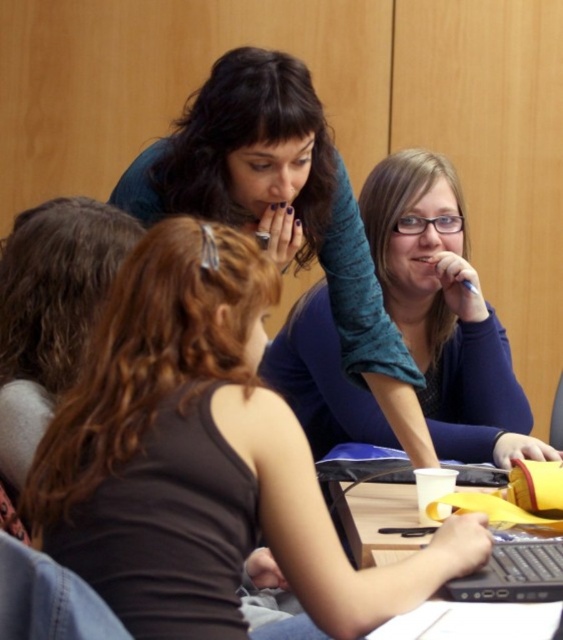
Question: Among these points, which one is nearest to the camera?

Choices:
 (A) (15, 445)
 (B) (122, 573)
 (C) (374, 547)
 (D) (230, 220)

Answer: (B)

Question: Which is nearer to the brown hair at upper left?

Choices:
 (A) wooden table at center
 (B) teal sweater at center
 (C) matte blue shirt at center
 (D) matte blue sweater at center

Answer: (C)

Question: Does teal sweater at center have a larger size compared to matte blue sweater at center?

Choices:
 (A) no
 (B) yes

Answer: (A)

Question: Is matte blue shirt at center behind matte blue sweater at center?

Choices:
 (A) no
 (B) yes

Answer: (A)

Question: Which point is closer to the camera?

Choices:
 (A) (52, 365)
 (B) (466, 385)
 (C) (163, 449)
 (D) (368, 556)

Answer: (C)

Question: Where is matte blue sweater at center located in relation to brown hair at upper left in the image?

Choices:
 (A) left
 (B) right

Answer: (B)